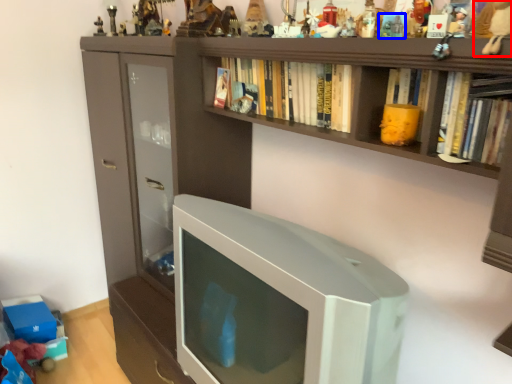
Question: Which point is further to the camera, toy (highlighted by a red box) or toy (highlighted by a blue box)?

Choices:
 (A) toy
 (B) toy

Answer: (B)